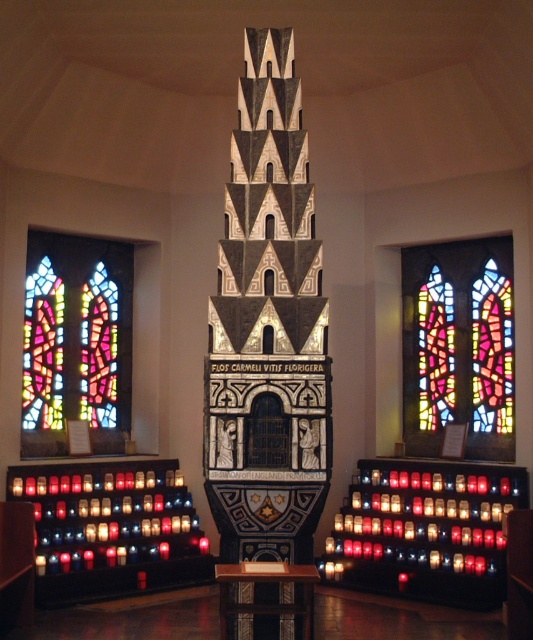
You are an architect visiting the chapel and need to determine the spatial relationship between the black stone tower at center and the stained glass window at center. Which object occupies more space in the image?

The black stone tower at center is larger in size than the stained glass window at center, so it occupies more space in the image.

You are an architect designing a new chapel and want to ensure there is enough space between the black stone tower at center and the stained glass window at center for a 10 meter long sculpture. Is the current distance sufficient?

The black stone tower at center is 12.95 meters from the stained glass window at center, so yes, the distance is sufficient to accommodate a 10 meter long sculpture between them.